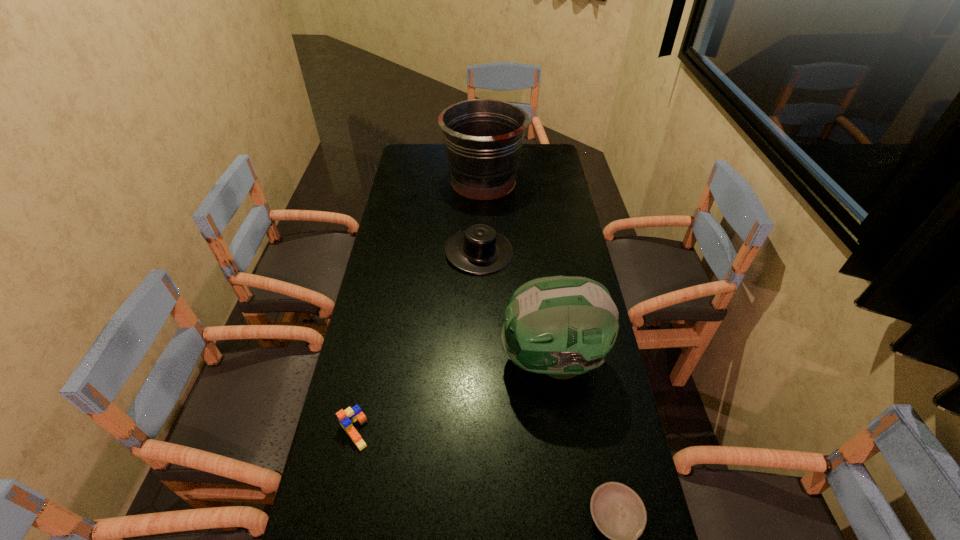
This screenshot has height=540, width=960. Find the location of `vacant space positioned on the back of the second farthest object`. vacant space positioned on the back of the second farthest object is located at coordinates (479, 191).

Locate an element on the screen. vacant area situated on the back of the fourth farthest object is located at coordinates (362, 394).

Locate an element on the screen. This screenshot has height=540, width=960. object that is at the far edge is located at coordinates (483, 138).

I want to click on object situated at the left edge, so click(347, 417).

At what (x,y) coordinates should I click in order to perform the action: click on object that is at the right edge. Please return your answer as a coordinate pair (x, y). This screenshot has height=540, width=960. Looking at the image, I should click on [x=562, y=326].

In the image, there is a desktop. Find the location of `vacant space at the left edge`. vacant space at the left edge is located at coordinates (395, 185).

In the image, there is a desktop. Where is `vacant space at the right edge`? This screenshot has width=960, height=540. vacant space at the right edge is located at coordinates (564, 263).

In the image, there is a desktop. Find the location of `vacant area at the far left corner`. vacant area at the far left corner is located at coordinates 427,166.

In the image, there is a desktop. At what (x,y) coordinates should I click in order to perform the action: click on vacant space at the far right corner. Please return your answer as a coordinate pair (x, y). Looking at the image, I should click on (540, 146).

This screenshot has height=540, width=960. Find the location of `vacant area that lies between the third tallest object and the bucket`. vacant area that lies between the third tallest object and the bucket is located at coordinates (481, 217).